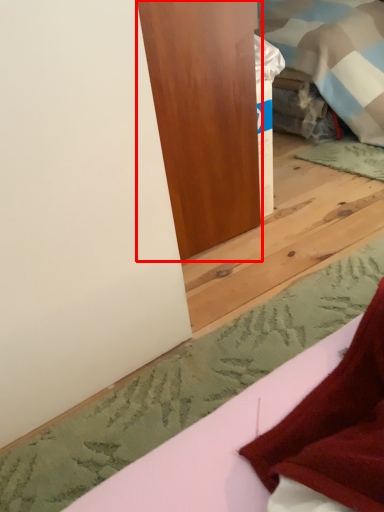
Question: From the image, what is the correct spatial relationship of furniture (annotated by the red box) in relation to sheet?

Choices:
 (A) right
 (B) left

Answer: (B)